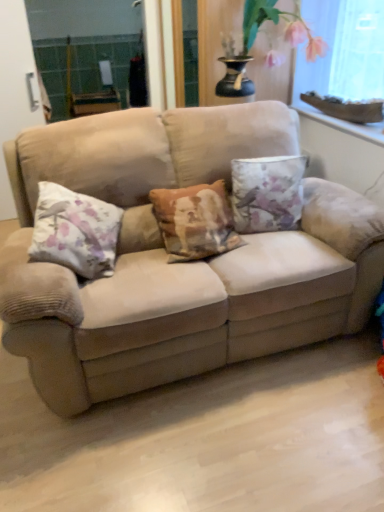
Question: Is beige fabric couch at center inside floral fabric cushion at left, the second pillow viewed from the right?

Choices:
 (A) no
 (B) yes

Answer: (A)

Question: Are floral fabric cushion at left, the second pillow viewed from the right, and beige fabric couch at center making contact?

Choices:
 (A) no
 (B) yes

Answer: (A)

Question: Is there a large distance between floral fabric cushion at left, the second pillow viewed from the right, and beige fabric couch at center?

Choices:
 (A) yes
 (B) no

Answer: (B)

Question: From the image's perspective, would you say floral fabric cushion at left, the first pillow when ordered from left to right, is shown under beige fabric couch at center?

Choices:
 (A) no
 (B) yes

Answer: (B)

Question: Is floral fabric cushion at left, the first pillow when ordered from left to right, shorter than beige fabric couch at center?

Choices:
 (A) yes
 (B) no

Answer: (A)

Question: Would you say clear glass screen door at left is to the left or to the right of floral fabric cushion at left, the first pillow when ordered from left to right, in the picture?

Choices:
 (A) left
 (B) right

Answer: (A)

Question: Is clear glass screen door at left bigger or smaller than floral fabric cushion at left, the first pillow when ordered from left to right?

Choices:
 (A) big
 (B) small

Answer: (B)

Question: From their relative heights in the image, would you say clear glass screen door at left is taller or shorter than floral fabric cushion at left, the second pillow viewed from the right?

Choices:
 (A) short
 (B) tall

Answer: (B)

Question: From the image's perspective, relative to floral fabric cushion at left, the second pillow viewed from the right, is clear glass screen door at left above or below?

Choices:
 (A) below
 (B) above

Answer: (B)

Question: Would you say floral bouquet at upper right is to the left or to the right of beige fabric couch at center in the picture?

Choices:
 (A) right
 (B) left

Answer: (A)

Question: Choose the correct answer: Is floral bouquet at upper right inside beige fabric couch at center or outside it?

Choices:
 (A) inside
 (B) outside

Answer: (B)

Question: From their relative heights in the image, would you say floral bouquet at upper right is taller or shorter than beige fabric couch at center?

Choices:
 (A) tall
 (B) short

Answer: (B)

Question: Based on their sizes in the image, would you say floral bouquet at upper right is bigger or smaller than beige fabric couch at center?

Choices:
 (A) big
 (B) small

Answer: (B)

Question: Considering the positions of point [x=326, y=64] and point [x=276, y=189], is point [x=326, y=64] closer or farther from the camera than point [x=276, y=189]?

Choices:
 (A) closer
 (B) farther

Answer: (B)

Question: In terms of size, does transparent plastic window screen at upper right appear bigger or smaller than floral fabric cushion at center, the 2th pillow in the left-to-right sequence?

Choices:
 (A) big
 (B) small

Answer: (A)